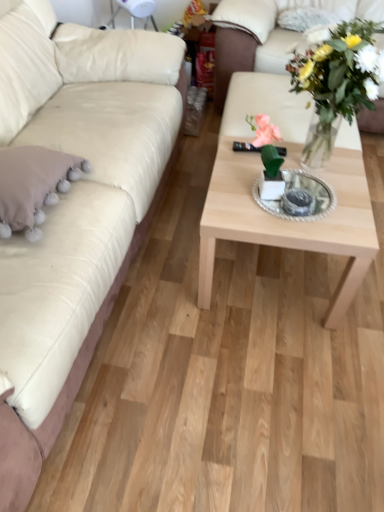
The image size is (384, 512). Find the location of `free spot above natural wood coffee table at center (from a real-world perspective)`. free spot above natural wood coffee table at center (from a real-world perspective) is located at coordinates (300, 177).